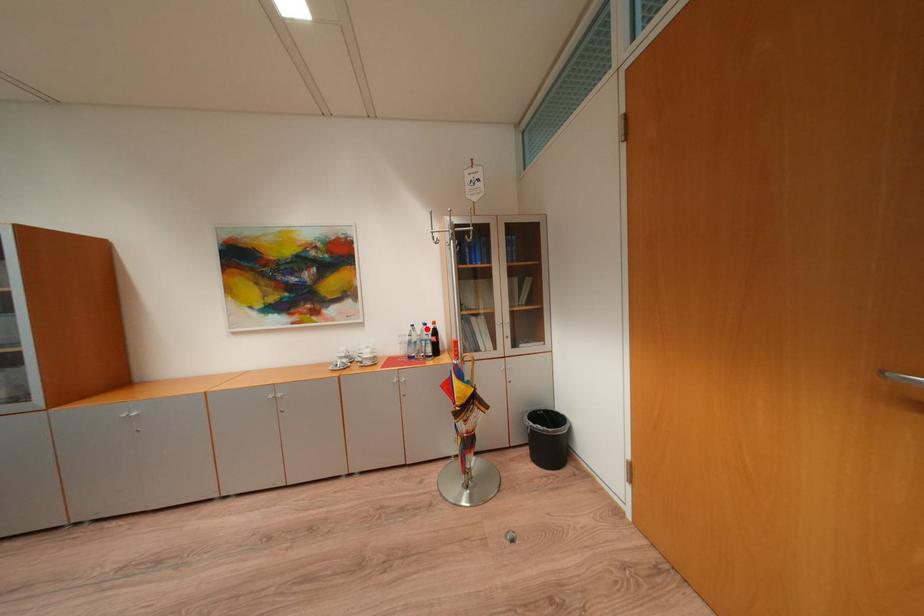
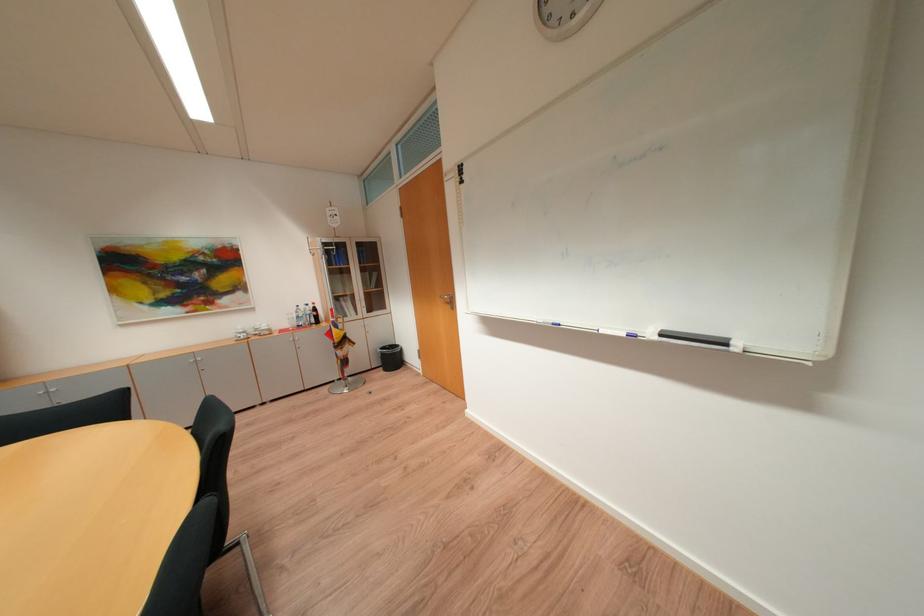
Locate, in the second image, the point that corresponds to the highlighted location in the first image.

(310, 309)